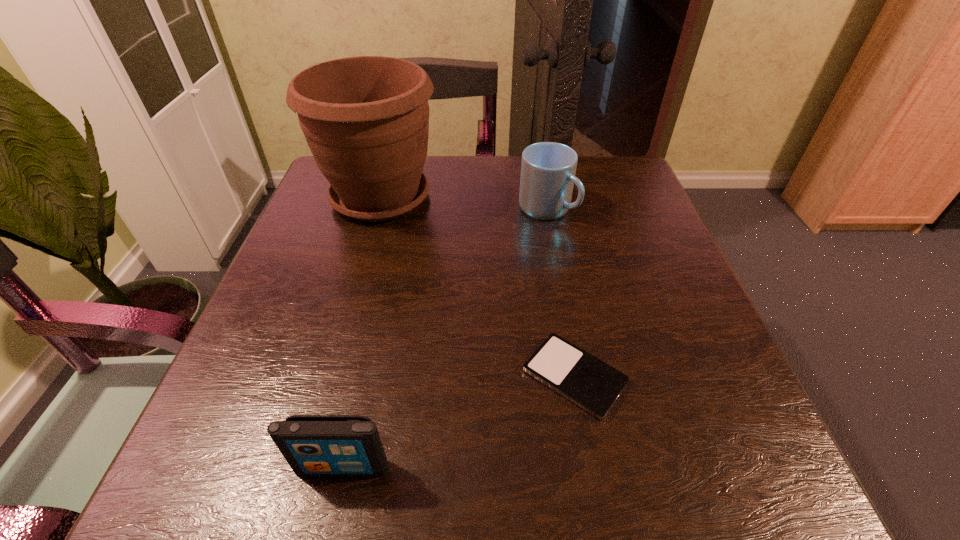
Identify which object is located as the second nearest to the tallest object. Please provide its 2D coordinates. Your answer should be formatted as a tuple, i.e. [(x, y)], where the tuple contains the x and y coordinates of a point satisfying the conditions above.

[(593, 385)]

Select which object appears as the third closest to the right iPod. Please provide its 2D coordinates. Your answer should be formatted as a tuple, i.e. [(x, y)], where the tuple contains the x and y coordinates of a point satisfying the conditions above.

[(366, 119)]

Find the location of `free space that satisfies the following two spatial constraints: 1. on the back side of the mug; 2. on the right side of the shortest object`. free space that satisfies the following two spatial constraints: 1. on the back side of the mug; 2. on the right side of the shortest object is located at coordinates coord(544,209).

Identify the location of vacant space that satisfies the following two spatial constraints: 1. on the back side of the shortest object; 2. on the right side of the mug. (544, 209).

Find the location of a particular element. free space that satisfies the following two spatial constraints: 1. on the front side of the tallest object; 2. on the right side of the mug is located at coordinates (377, 209).

Image resolution: width=960 pixels, height=540 pixels. What are the coordinates of `vacant point that satisfies the following two spatial constraints: 1. on the front side of the shortest object; 2. on the right side of the flowerpot` in the screenshot? It's located at (329, 376).

Find the location of a particular element. The image size is (960, 540). vacant space that satisfies the following two spatial constraints: 1. on the front side of the tallest object; 2. on the right side of the mug is located at coordinates (377, 209).

This screenshot has height=540, width=960. What are the coordinates of `vacant space that satisfies the following two spatial constraints: 1. on the front side of the mug; 2. on the left side of the tallest object` in the screenshot? It's located at (377, 209).